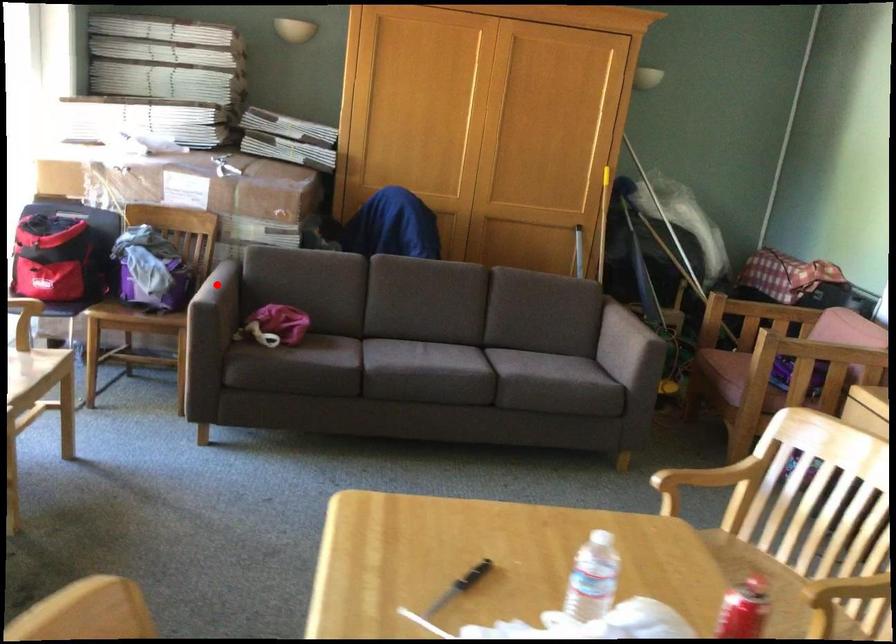
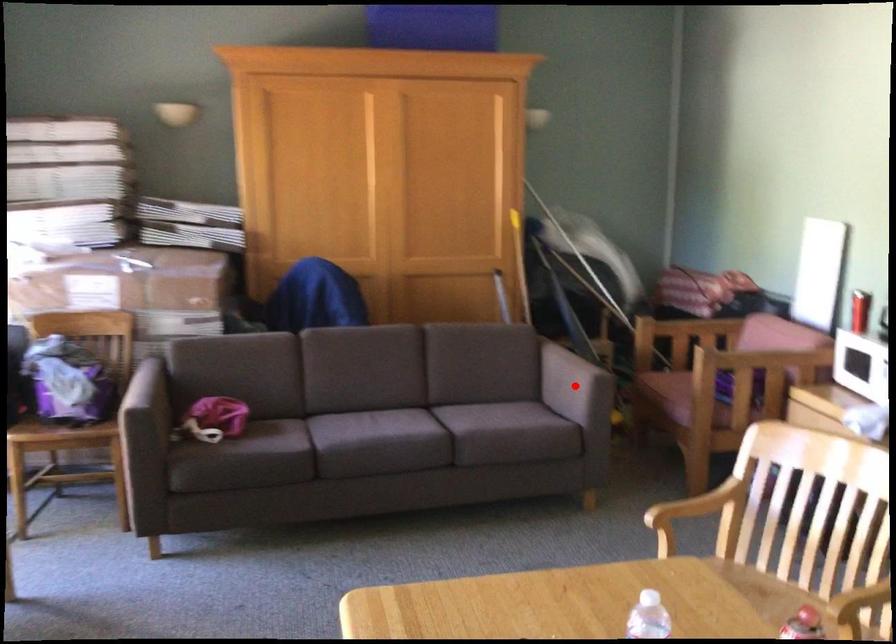
I am providing you with two images of the same scene from different viewpoints. A red point is marked on the first image and another point is marked on the second image. Is the marked point in image1 the same physical position as the marked point in image2?

No